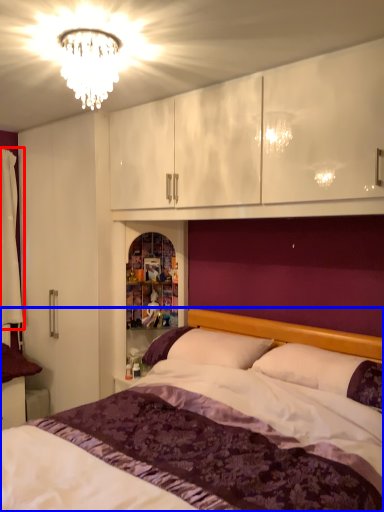
Question: Which object is further to the camera taking this photo, curtain (highlighted by a red box) or bed (highlighted by a blue box)?

Choices:
 (A) curtain
 (B) bed

Answer: (A)